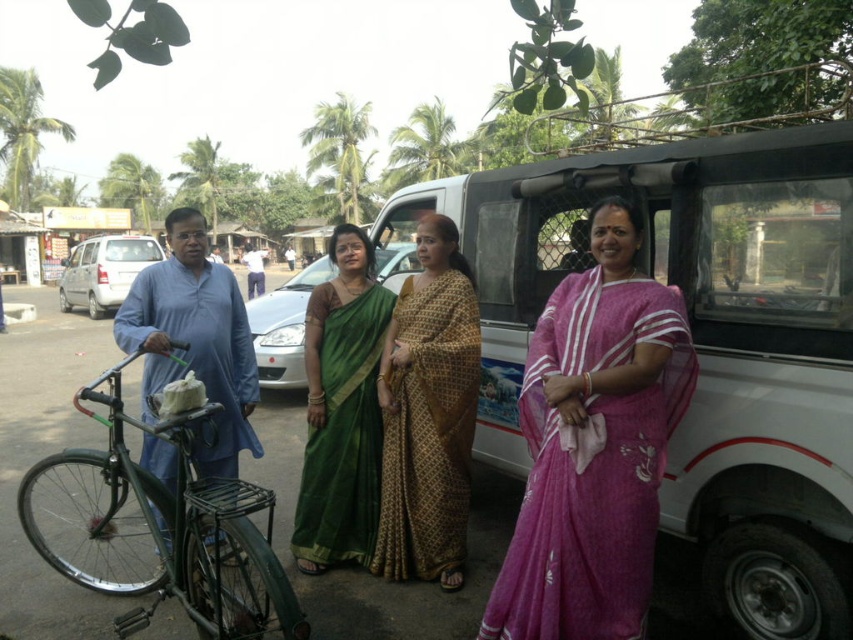
Between pink silk saree at center and green silk saree at center, which one is positioned higher?

Positioned higher is pink silk saree at center.

Who is more distant from viewer, [595,380] or [317,566]?

Point [317,566]

This screenshot has width=853, height=640. I want to click on pink silk saree at center, so click(595, 444).

At what (x,y) coordinates should I click in order to perform the action: click on pink silk saree at center. Please return your answer as a coordinate pair (x, y). Image resolution: width=853 pixels, height=640 pixels. Looking at the image, I should click on (595, 444).

Is green matte bicycle at left above gold printed saree at center?

No.

Between green matte bicycle at left and gold printed saree at center, which one has more height?

With more height is gold printed saree at center.

Is point (103, 532) less distant than point (456, 339)?

That is True.

The width and height of the screenshot is (853, 640). Identify the location of green matte bicycle at left. (173, 528).

Does green silk saree at center have a smaller size compared to blue cotton shirt at left?

Yes, green silk saree at center is smaller than blue cotton shirt at left.

Which is below, green silk saree at center or blue cotton shirt at left?

green silk saree at center is lower down.

The image size is (853, 640). Identify the location of green silk saree at center. (341, 410).